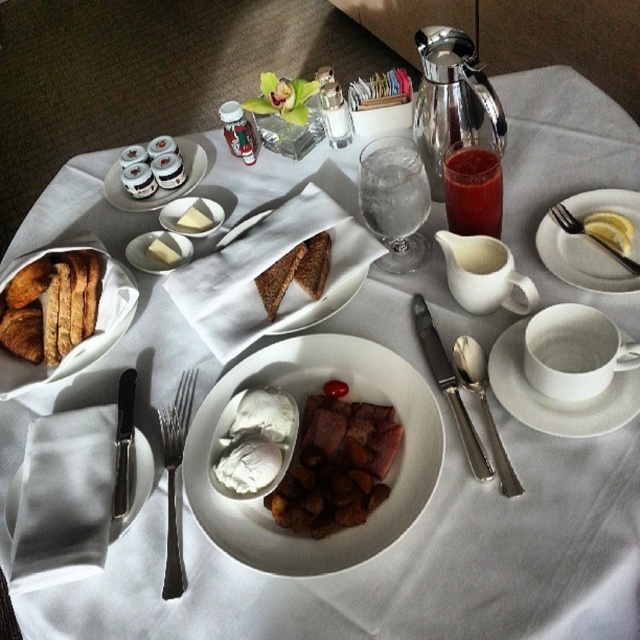
Is the position of white matte plate at center more distant than that of white creamy sauce at center?

That is False.

Does white matte plate at center appear on the left side of white creamy sauce at center?

In fact, white matte plate at center is to the right of white creamy sauce at center.

Is point (196, 509) positioned before point (253, 422)?

Yes, it is in front of point (253, 422).

I want to click on white matte plate at center, so click(300, 410).

Does white ceramic plate at upper right have a larger size compared to yellow butter at center?

Correct, white ceramic plate at upper right is larger in size than yellow butter at center.

What do you see at coordinates (580, 260) in the screenshot? The image size is (640, 640). I see `white ceramic plate at upper right` at bounding box center [580, 260].

Identify the location of white ceramic plate at upper right. (580, 260).

Between point (352, 454) and point (177, 429), which one is positioned behind?

Point (177, 429)

Between brown crispy hash browns at center and silvermetallicfork at left, which one appears on the left side from the viewer's perspective?

From the viewer's perspective, silvermetallicfork at left appears more on the left side.

At what (x,y) coordinates should I click in order to perform the action: click on brown crispy hash browns at center. Please return your answer as a coordinate pair (x, y). This screenshot has width=640, height=640. Looking at the image, I should click on (336, 465).

At what (x,y) coordinates should I click in order to perform the action: click on brown crispy hash browns at center. Please return your answer as a coordinate pair (x, y). Looking at the image, I should click on (336, 465).